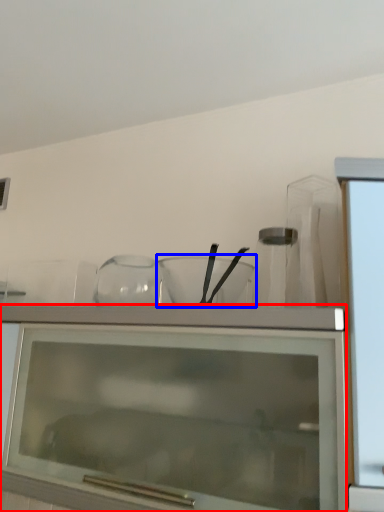
Question: Which point is further to the camera, cabinetry (highlighted by a red box) or mixing bowl (highlighted by a blue box)?

Choices:
 (A) cabinetry
 (B) mixing bowl

Answer: (B)